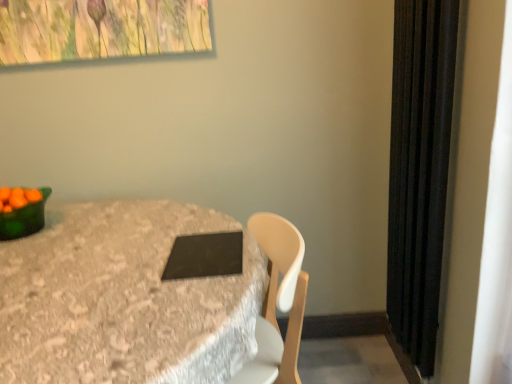
Question: Does matte black tablet at center have a lesser height compared to green glossy bowl at left?

Choices:
 (A) no
 (B) yes

Answer: (A)

Question: Is matte black tablet at center in front of green glossy bowl at left?

Choices:
 (A) no
 (B) yes

Answer: (B)

Question: Is matte black tablet at center oriented towards green glossy bowl at left?

Choices:
 (A) yes
 (B) no

Answer: (B)

Question: From a real-world perspective, is matte black tablet at center physically below green glossy bowl at left?

Choices:
 (A) no
 (B) yes

Answer: (B)

Question: Is matte black tablet at center directly adjacent to green glossy bowl at left?

Choices:
 (A) yes
 (B) no

Answer: (B)

Question: In the image, is matte black tablet at center positioned in front of or behind green matte bowl at left?

Choices:
 (A) front
 (B) behind

Answer: (A)

Question: From a real-world perspective, is matte black tablet at center above or below green matte bowl at left?

Choices:
 (A) below
 (B) above

Answer: (A)

Question: From the image's perspective, relative to green matte bowl at left, is matte black tablet at center above or below?

Choices:
 (A) above
 (B) below

Answer: (B)

Question: Is matte black tablet at center situated inside green matte bowl at left or outside?

Choices:
 (A) outside
 (B) inside

Answer: (A)

Question: Is matte black tablet at center bigger or smaller than black matte pad at center?

Choices:
 (A) small
 (B) big

Answer: (B)

Question: Considering the positions of point (106, 329) and point (195, 249), is point (106, 329) closer or farther from the camera than point (195, 249)?

Choices:
 (A) closer
 (B) farther

Answer: (A)

Question: Based on their positions, is matte black tablet at center located to the left or right of black matte pad at center?

Choices:
 (A) left
 (B) right

Answer: (A)

Question: Choose the correct answer: Is matte black tablet at center inside black matte pad at center or outside it?

Choices:
 (A) inside
 (B) outside

Answer: (B)

Question: Based on their positions, is green matte bowl at left located to the left or right of black matte pad at center?

Choices:
 (A) right
 (B) left

Answer: (B)

Question: Considering the positions of green matte bowl at left and black matte pad at center in the image, is green matte bowl at left taller or shorter than black matte pad at center?

Choices:
 (A) short
 (B) tall

Answer: (B)